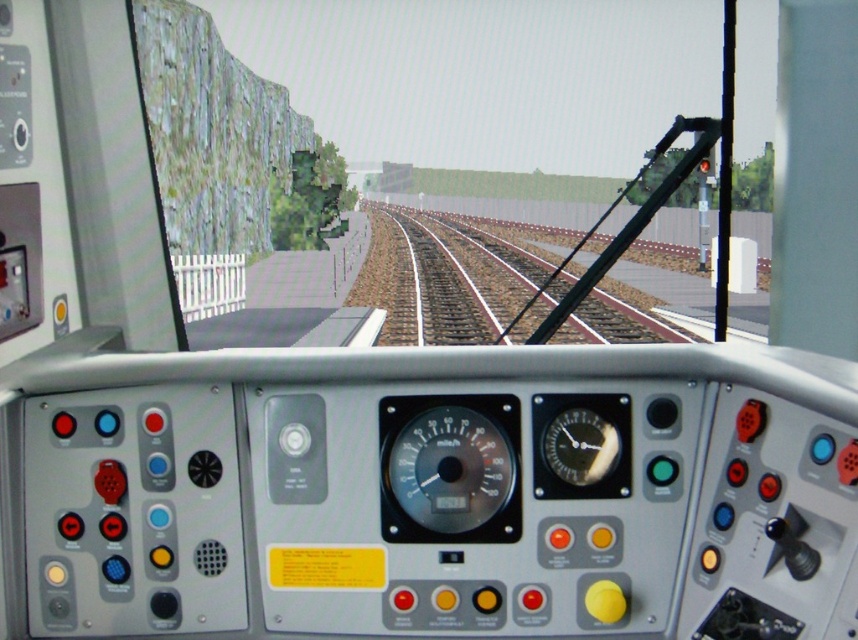
Identify the location of matte black speedometer at center. (449, 468).

Can you confirm if matte black speedometer at center is taller than shiny black clock at center?

Yes.

The height and width of the screenshot is (640, 858). What do you see at coordinates (449, 468) in the screenshot?
I see `matte black speedometer at center` at bounding box center [449, 468].

In order to click on matte black speedometer at center in this screenshot , I will do `click(449, 468)`.

At what (x,y) coordinates should I click in order to perform the action: click on matte black speedometer at center. Please return your answer as a coordinate pair (x, y). This screenshot has width=858, height=640. Looking at the image, I should click on (449, 468).

In the scene shown: Does matte black speedometer at center appear on the right side of brown gravel track at center?

In fact, matte black speedometer at center is to the left of brown gravel track at center.

Between point (397, 436) and point (511, 304), which one is positioned in front?

Point (397, 436) is in front.

Locate an element on the screen. This screenshot has height=640, width=858. matte black speedometer at center is located at coordinates coord(449,468).

Is point (523, 284) in front of point (606, 449)?

No, (523, 284) is behind (606, 449).

Can you confirm if brown gravel track at center is taller than shiny black clock at center?

Correct, brown gravel track at center is much taller as shiny black clock at center.

The width and height of the screenshot is (858, 640). In order to click on brown gravel track at center in this screenshot , I will do 494,272.

Find the location of a particular element. Image resolution: width=858 pixels, height=640 pixels. brown gravel track at center is located at coordinates (494, 272).